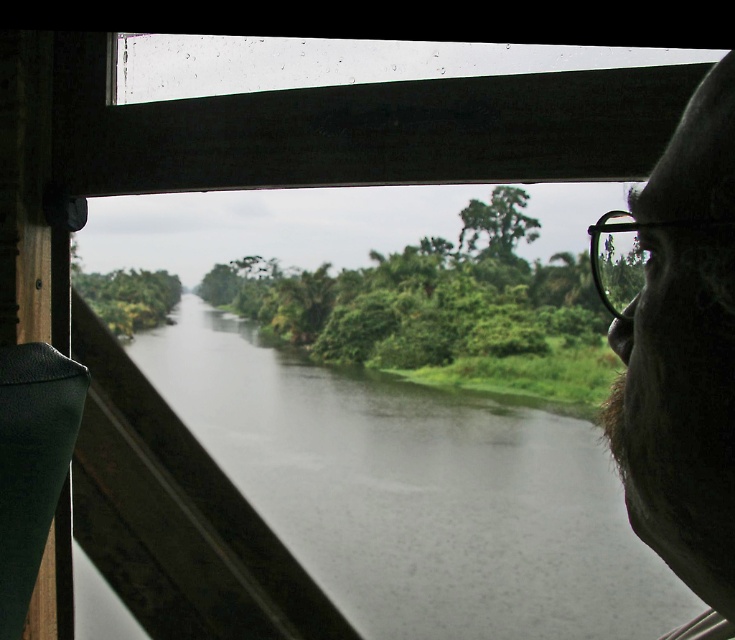
Question: Which point is farther from the camera taking this photo?

Choices:
 (A) (441, 440)
 (B) (727, 531)

Answer: (A)

Question: Does dark gray water at center appear under dark brown fur at right?

Choices:
 (A) no
 (B) yes

Answer: (B)

Question: Is dark gray water at center positioned at the back of dark brown fur at right?

Choices:
 (A) no
 (B) yes

Answer: (B)

Question: Considering the relative positions of dark gray water at center and dark brown fur at right in the image provided, where is dark gray water at center located with respect to dark brown fur at right?

Choices:
 (A) below
 (B) above

Answer: (A)

Question: Which point is closer to the camera?

Choices:
 (A) dark gray water at center
 (B) dark brown fur at right

Answer: (B)